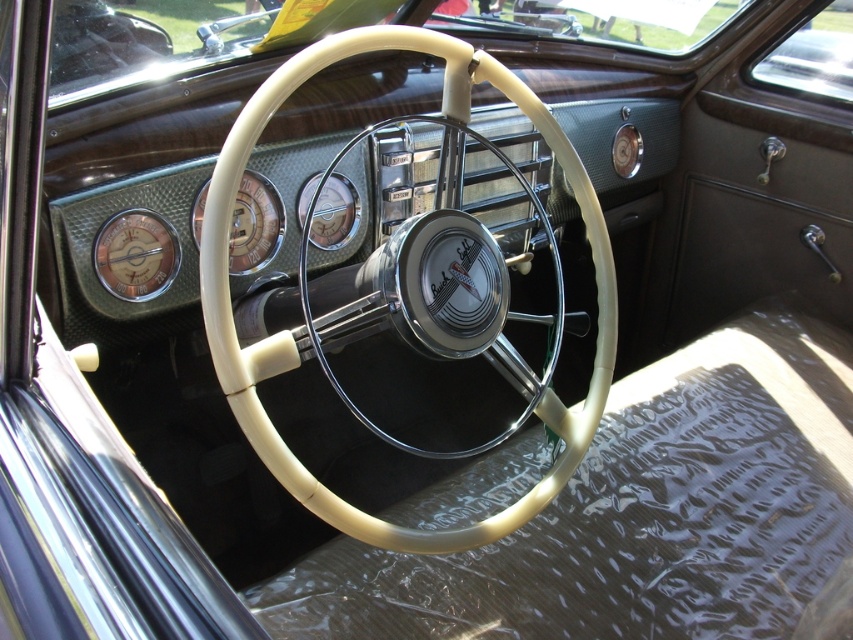
Question: Among these objects, which one is farthest from the camera?

Choices:
 (A) creamy white steering wheel at center
 (B) matte silver gauge at center left

Answer: (B)

Question: Which point is closer to the camera?

Choices:
 (A) creamy white steering wheel at center
 (B) matte silver gauge at center left

Answer: (A)

Question: Observing the image, what is the correct spatial positioning of creamy white steering wheel at center in reference to matte silver gauge at center left?

Choices:
 (A) right
 (B) left

Answer: (A)

Question: Is creamy white steering wheel at center positioned behind matte silver gauge at center left?

Choices:
 (A) no
 (B) yes

Answer: (A)

Question: Which object appears farthest from the camera in this image?

Choices:
 (A) matte silver gauge at center left
 (B) creamy white steering wheel at center

Answer: (A)

Question: Can you confirm if creamy white steering wheel at center is positioned above matte silver gauge at center left?

Choices:
 (A) no
 (B) yes

Answer: (A)